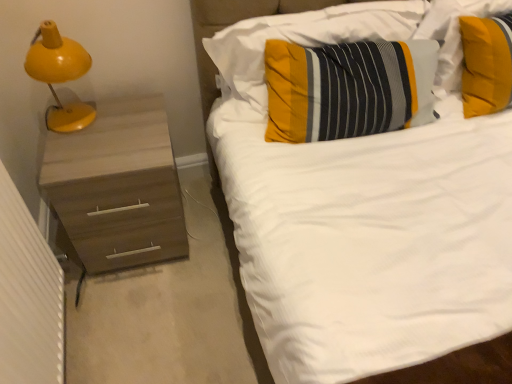
At what (x,y) coordinates should I click in order to perform the action: click on vacant area that is situated to the right of yellow matte lamp at left. Please return your answer as a coordinate pair (x, y). This screenshot has height=384, width=512. Looking at the image, I should click on (124, 134).